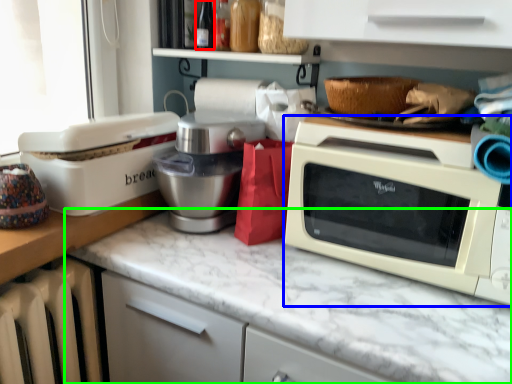
Question: Estimate the real-world distances between objects in this image. Which object is closer to bottle (highlighted by a red box), microwave oven (highlighted by a blue box) or countertop (highlighted by a green box)?

Choices:
 (A) microwave oven
 (B) countertop

Answer: (A)